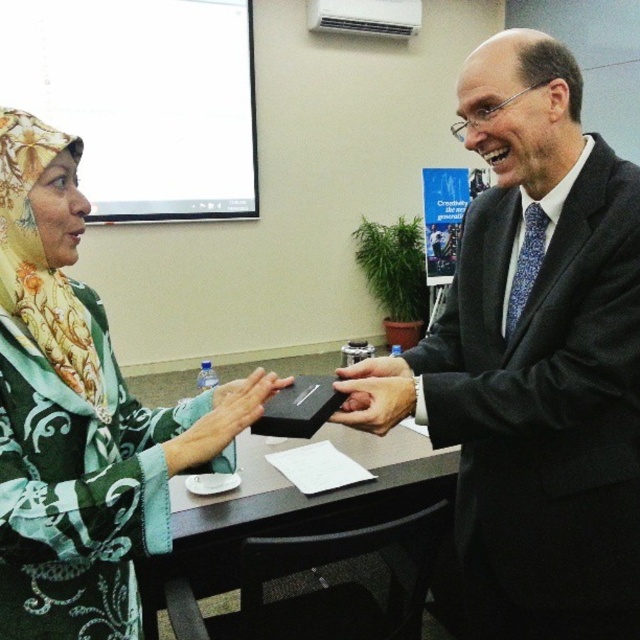
Question: Can you confirm if matte black suit at center is positioned to the right of matte black box at center?

Choices:
 (A) yes
 (B) no

Answer: (A)

Question: Is matte black suit at center thinner than matte black box at center?

Choices:
 (A) no
 (B) yes

Answer: (A)

Question: Which object is the closest to the green floral scarf at left?

Choices:
 (A) matte black phone at center
 (B) black matte table at center

Answer: (A)

Question: Which object is positioned closest to the matte black box at center?

Choices:
 (A) matte black suit at center
 (B) matte black phone at center
 (C) green floral scarf at left
 (D) black matte table at center

Answer: (C)

Question: Which of the following is the farthest from the observer?

Choices:
 (A) matte black phone at center
 (B) black matte table at center

Answer: (B)

Question: Is black matte table at center thinner than matte black box at center?

Choices:
 (A) no
 (B) yes

Answer: (A)